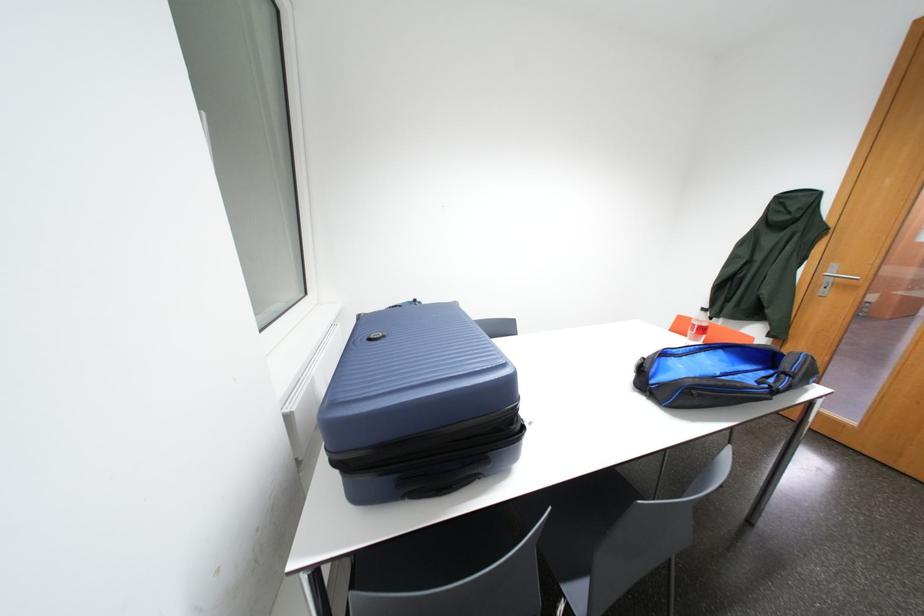
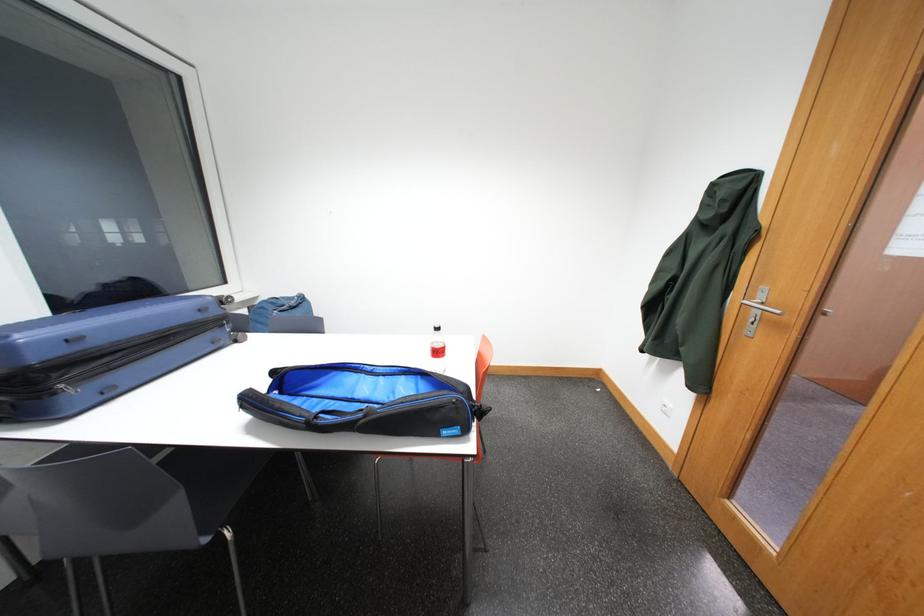
Question: In a continuous first-person perspective shot, in which direction is the camera moving?

Choices:
 (A) Left
 (B) Right
 (C) Forward
 (D) Backward

Answer: (B)